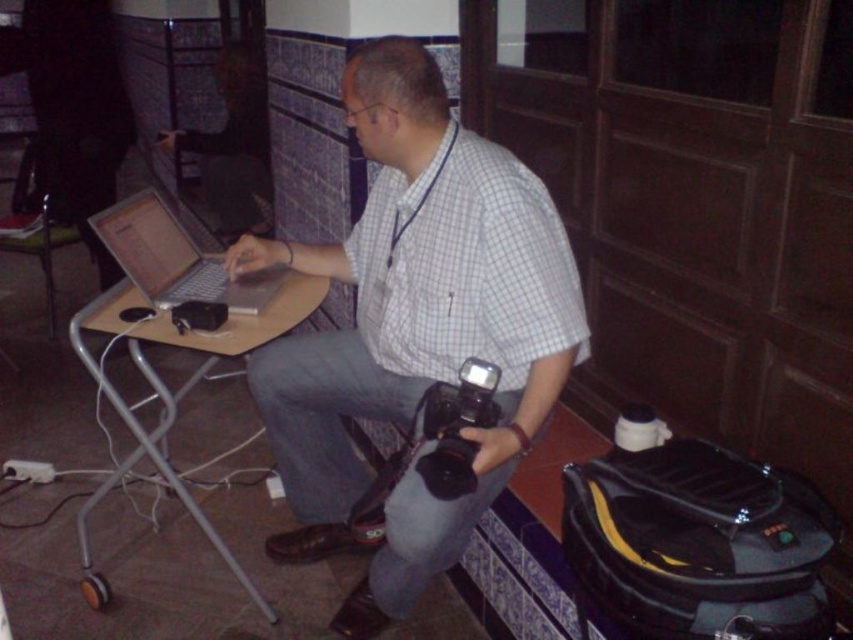
You are organizing a photography event and need to ensure that all equipment fits on the wooden table at center. The black plastic video camera at lower center is part of the equipment. Considering the size difference, will the camera fit on the table?

The wooden table at center is bigger than the black plastic video camera at lower center, so the camera will fit on the table.